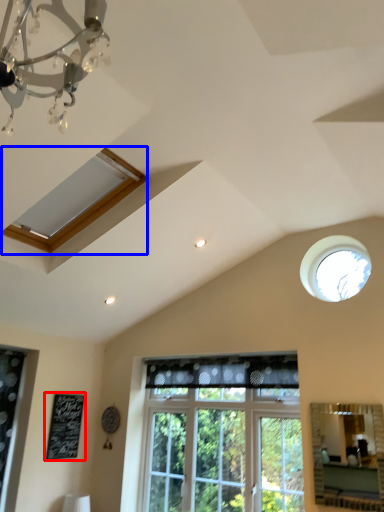
Question: Which object appears closest to the camera in this image, bulletin board (highlighted by a red box) or window (highlighted by a blue box)?

Choices:
 (A) bulletin board
 (B) window

Answer: (B)